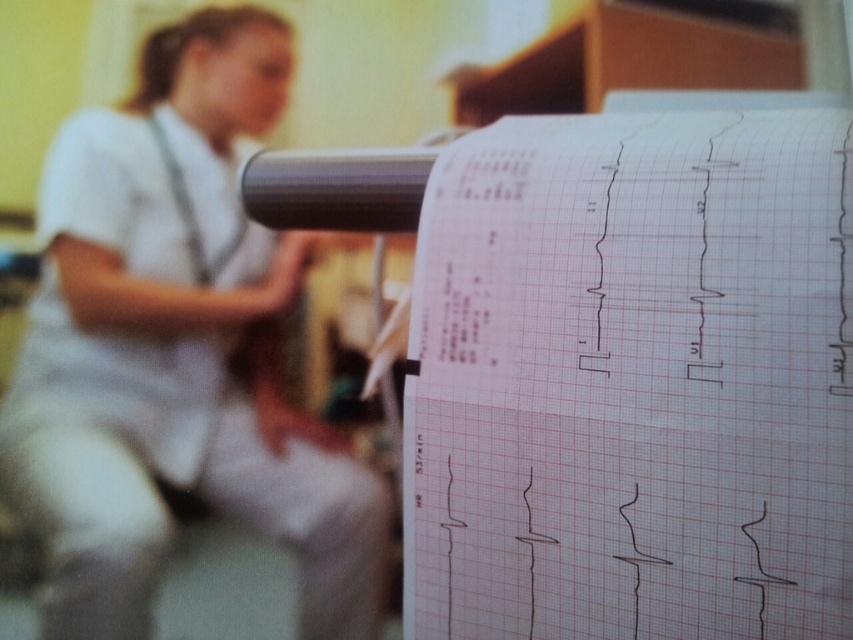
Question: Does white graph paper at center have a larger size compared to white uniform at upper left?

Choices:
 (A) no
 (B) yes

Answer: (A)

Question: Which object is closer to the camera taking this photo?

Choices:
 (A) white graph paper at center
 (B) white uniform at upper left

Answer: (A)

Question: Is white graph paper at center wider than white uniform at upper left?

Choices:
 (A) yes
 (B) no

Answer: (B)

Question: Is white graph paper at center further to the viewer compared to white uniform at upper left?

Choices:
 (A) no
 (B) yes

Answer: (A)

Question: Which point appears closest to the camera in this image?

Choices:
 (A) (308, 577)
 (B) (701, 224)

Answer: (B)